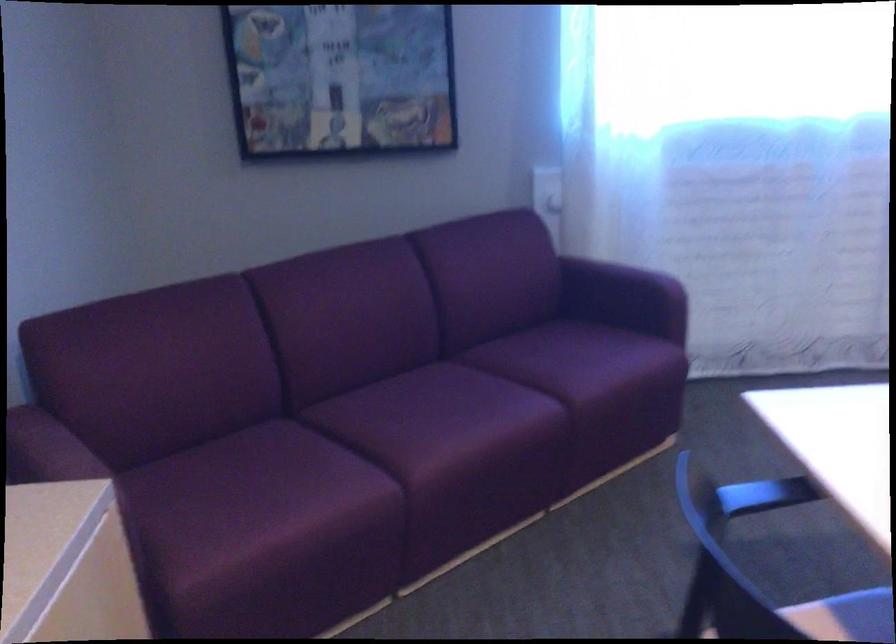
You are a GUI agent. You are given a task and a screenshot of the screen. Output one action in this format:
    pyautogui.click(x=<x>, y=<y>)
    Task: Click on the white rocker switch
    
    Given the screenshot: What is the action you would take?
    pyautogui.click(x=547, y=191)